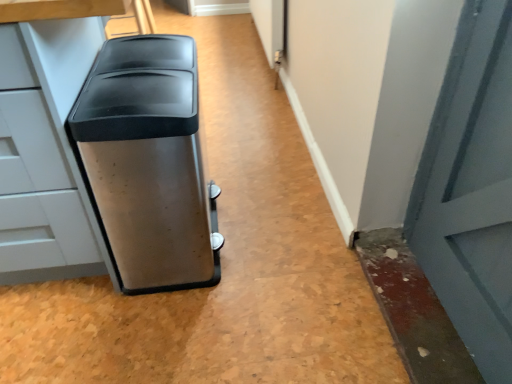
Question: Based on their positions, is stainless steel trash can at center located to the left or right of satin metallic trash can at left?

Choices:
 (A) right
 (B) left

Answer: (A)

Question: Does point (156, 163) appear closer or farther from the camera than point (40, 39)?

Choices:
 (A) farther
 (B) closer

Answer: (A)

Question: From the image's perspective, is stainless steel trash can at center above or below satin metallic trash can at left?

Choices:
 (A) below
 (B) above

Answer: (A)

Question: Is satin metallic trash can at left inside the boundaries of stainless steel trash can at center, or outside?

Choices:
 (A) outside
 (B) inside

Answer: (A)

Question: Based on their sizes in the image, would you say satin metallic trash can at left is bigger or smaller than stainless steel trash can at center?

Choices:
 (A) big
 (B) small

Answer: (A)

Question: From their relative heights in the image, would you say satin metallic trash can at left is taller or shorter than stainless steel trash can at center?

Choices:
 (A) tall
 (B) short

Answer: (A)

Question: Looking at their shapes, would you say satin metallic trash can at left is wider or thinner than stainless steel trash can at center?

Choices:
 (A) thin
 (B) wide

Answer: (B)